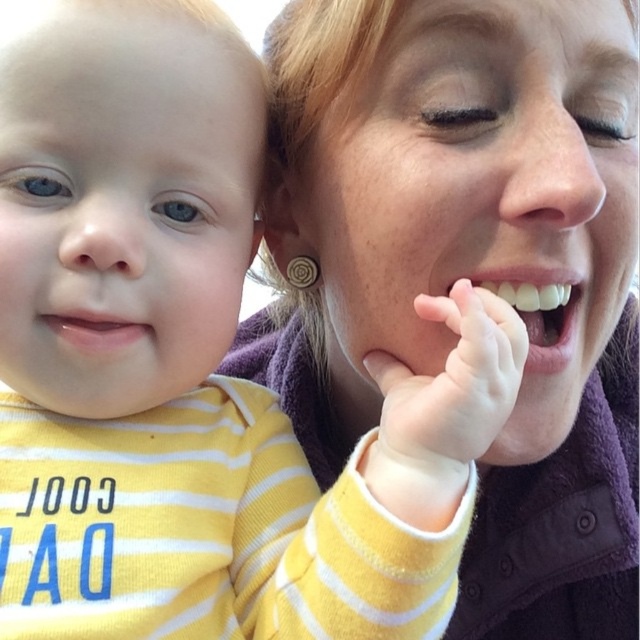
You are a photographer trying to adjust the focus of your camera to capture the interaction between the baby and the adult. Since the soft pink skin at mouth right and the matte purple jacket at center are both important, which one is closer to the camera so you can prioritize focusing on it?

The soft pink skin at mouth right is behind matte purple jacket at center, so the matte purple jacket at center is closer to the camera. Therefore, you should prioritize focusing on the matte purple jacket at center to ensure it is in sharp focus.

You are holding a small toy that is 12 inches long. You want to place it from your current position to the point marked at coordinate (502, 358) in the image. Can the toy fit entirely within the space between you and that point?

The distance between you and the point marked at coordinate (502, 358) is 15.34 inches. Since the toy is 12 inches long, it can fit entirely within the space as 12 inches is shorter than 15.34 inches.

You are a photographer trying to capture a closeup shot of the soft pink skin at mouth right. Your camera has a minimum focusing distance of 12 inches. Can you take the photo without moving closer than 12 inches?

The soft pink skin at mouth right and viewer are 14.43 inches apart from each other, so yes, you can take the photo without moving closer than 12 inches because the distance is sufficient.